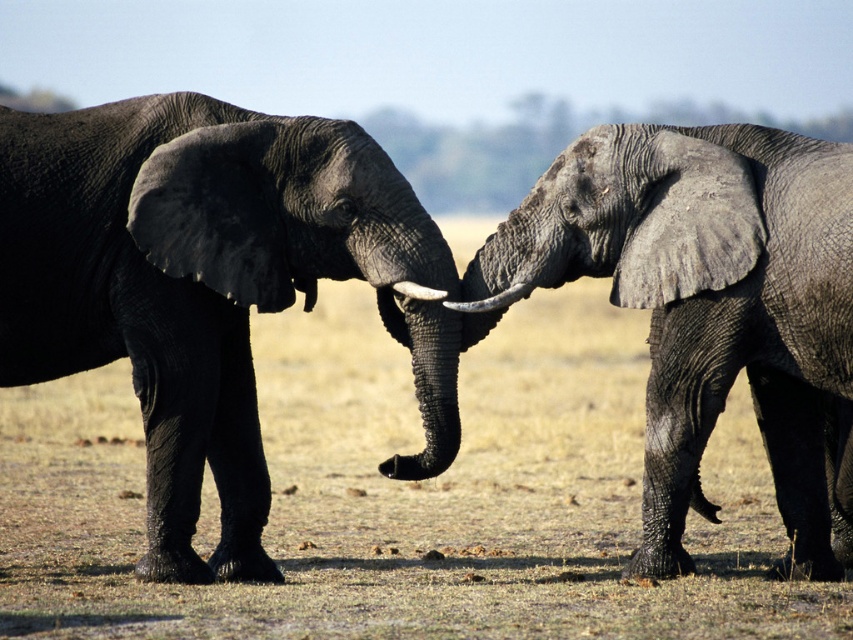
Is gray textured elephant at left bigger than gray rough elephant at right?

Yes, gray textured elephant at left is bigger than gray rough elephant at right.

Which of these two, gray textured elephant at left or gray rough elephant at right, stands shorter?

With less height is gray rough elephant at right.

Is point (186, 317) positioned after point (582, 154)?

That is True.

Identify the location of gray textured elephant at left. Image resolution: width=853 pixels, height=640 pixels. [x=207, y=285].

Is gray textured elephant at left to the right of white smooth tusk at center from the viewer's perspective?

In fact, gray textured elephant at left is to the left of white smooth tusk at center.

Can you confirm if gray textured elephant at left is smaller than white smooth tusk at center?

No.

Where is `gray textured elephant at left`? gray textured elephant at left is located at coordinates (207, 285).

Is point (564, 497) farther from camera compared to point (523, 292)?

Yes, it is behind point (523, 292).

Does point (589, 337) come in front of point (445, 301)?

No, it is behind (445, 301).

The image size is (853, 640). What are the coordinates of `brown dry grass at center` in the screenshot? It's located at (405, 496).